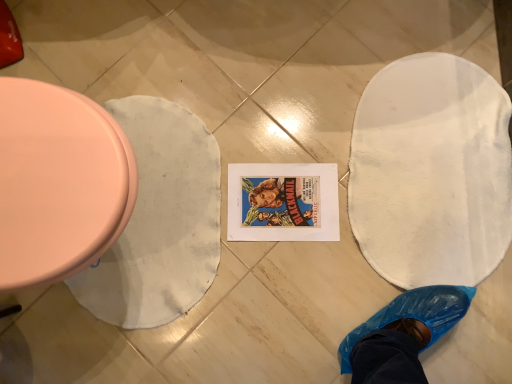
Question: Relative to matte pink toilet at left, is white fabric blanket at left in front or behind?

Choices:
 (A) front
 (B) behind

Answer: (B)

Question: Is white fabric blanket at left taller or shorter than matte pink toilet at left?

Choices:
 (A) short
 (B) tall

Answer: (A)

Question: In terms of width, does white fabric blanket at left look wider or thinner when compared to matte pink toilet at left?

Choices:
 (A) wide
 (B) thin

Answer: (B)

Question: Considering the positions of matte pink toilet at left and white fabric blanket at left in the image, is matte pink toilet at left wider or thinner than white fabric blanket at left?

Choices:
 (A) wide
 (B) thin

Answer: (A)

Question: Is matte pink toilet at left bigger or smaller than white fabric blanket at left?

Choices:
 (A) big
 (B) small

Answer: (A)

Question: Would you say matte pink toilet at left is to the left or to the right of white fabric blanket at left in the picture?

Choices:
 (A) right
 (B) left

Answer: (B)

Question: From the image's perspective, is matte pink toilet at left above or below white fabric blanket at left?

Choices:
 (A) above
 (B) below

Answer: (A)